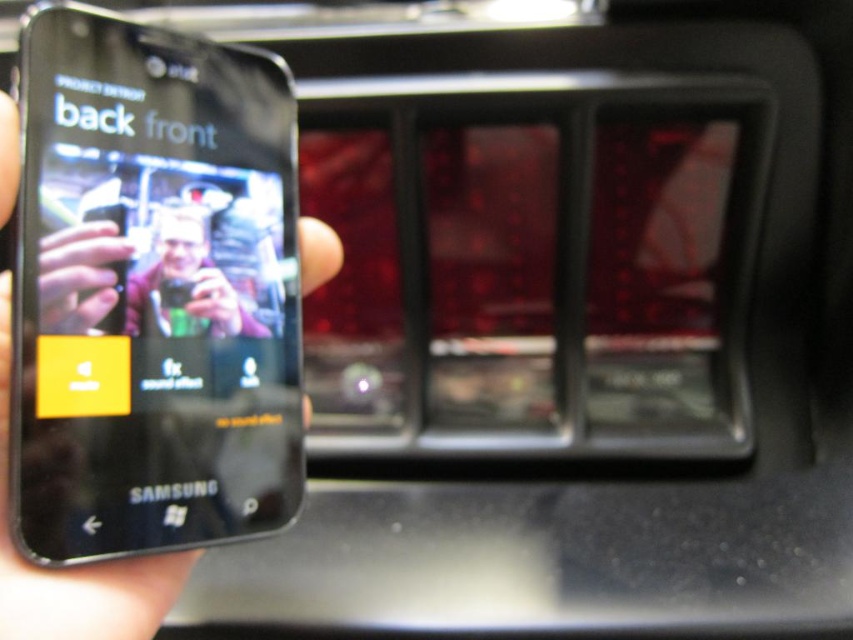
You are designing a phone case that needs to fit the black matte phone at left and the matte black phone at left. Which phone requires a larger case?

The black matte phone at left requires a larger case because it has a larger size compared to the matte black phone at left.

Looking at this image, you are holding a smartphone and want to take a photo of a nearby object. The camera interface shows a point at coordinates point (x=25, y=317). If the camera can focus on objects within 14 inches, will it be able to focus on the point?

The point (x=25, y=317) is 13.98 inches away from the camera, so yes, the camera can focus on it since it is within the 14 inches range.

You are a photographer trying to capture a detailed shot of the black matte phone at left in the image. Given its position at point coordinates, what is the best way to ensure the phone is centered in your frame?

To center the black matte phone at left, position your camera so the phone aligns with the crosshairs at point coordinates, ensuring it sits in the middle of your viewfinder.